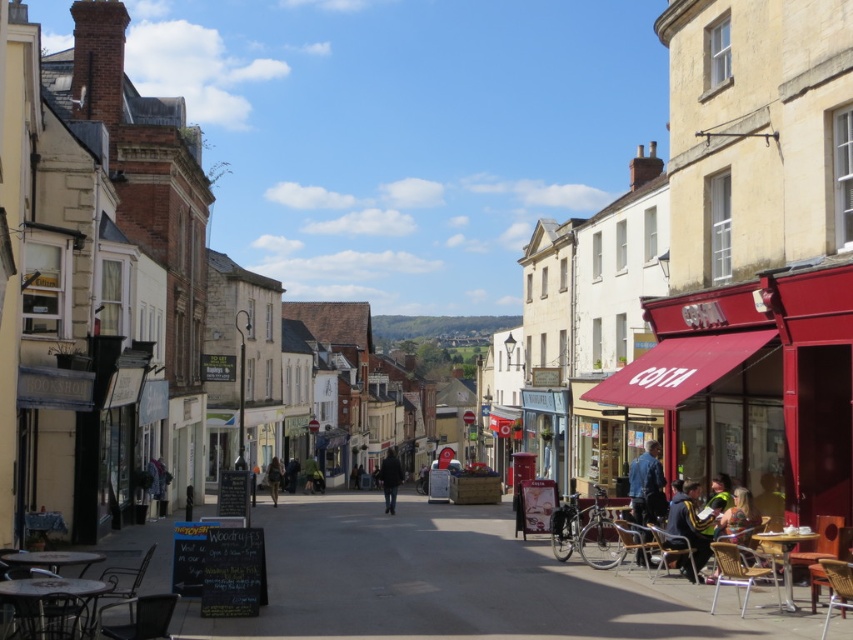
Between point (637, 516) and point (294, 481), which one is positioned in front?

Point (637, 516) is more forward.

Which is above, blue denim jacket at lower right or dark blue jacket at center?

blue denim jacket at lower right

Find the location of a particular element. Image resolution: width=853 pixels, height=640 pixels. blue denim jacket at lower right is located at coordinates (647, 484).

The image size is (853, 640). I want to click on black matte coat at center, so click(390, 477).

Can you confirm if black matte coat at center is taller than dark blue jacket at center?

Yes.

Is point (398, 472) positioned in front of point (289, 481)?

That is True.

The image size is (853, 640). I want to click on black matte coat at center, so click(390, 477).

Does point (825, 289) lie in front of point (306, 481)?

Yes, point (825, 289) is in front of point (306, 481).

Can you confirm if maroon awning at right is positioned to the right of green fabric coat at center?

Correct, you'll find maroon awning at right to the right of green fabric coat at center.

At what (x,y) coordinates should I click in order to perform the action: click on maroon awning at right. Please return your answer as a coordinate pair (x, y). Image resolution: width=853 pixels, height=640 pixels. Looking at the image, I should click on click(753, 387).